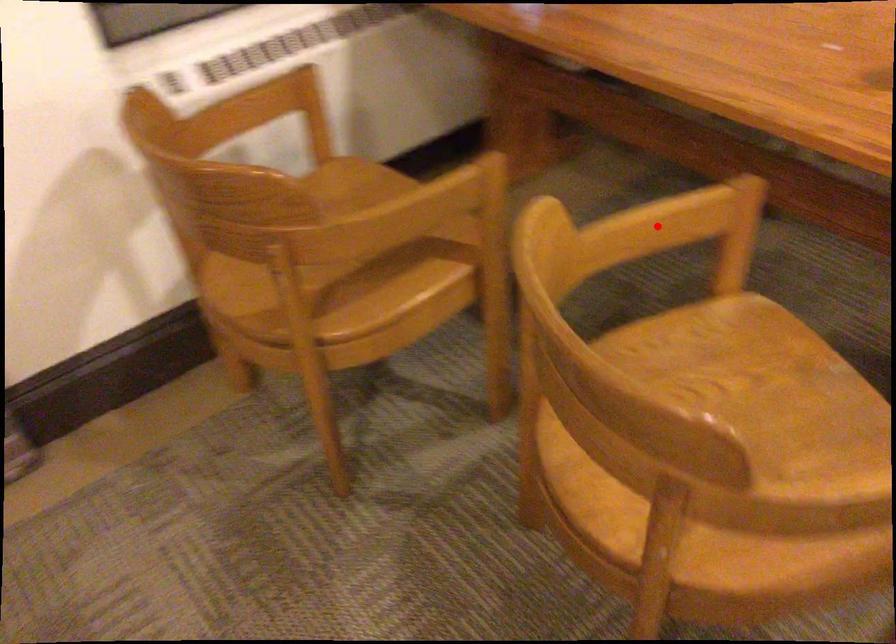
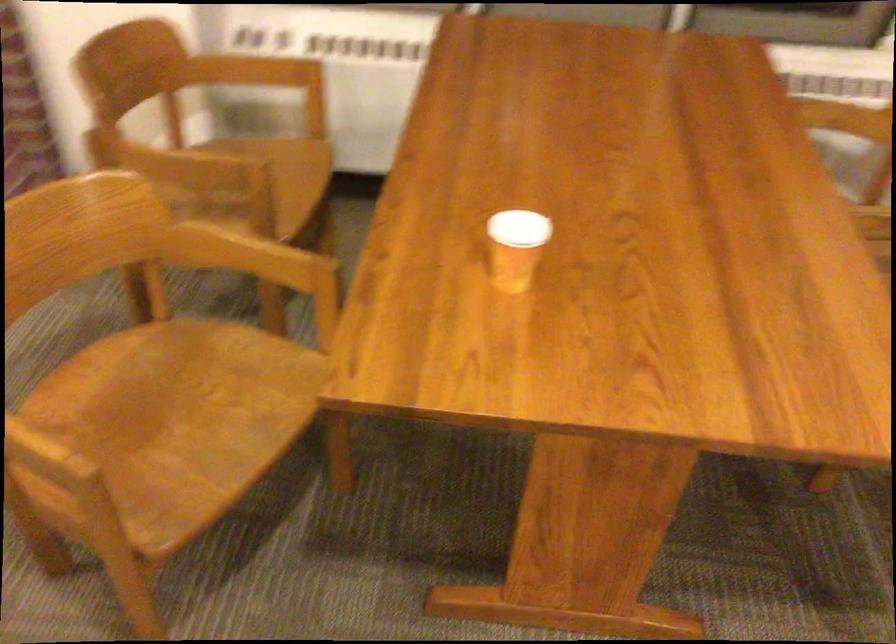
Locate, in the second image, the point that corresponds to the highlighted location in the first image.

(248, 257)